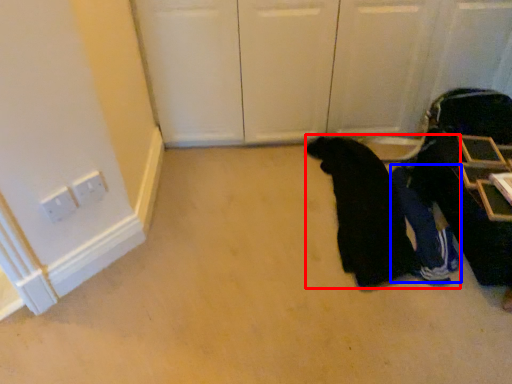
Question: Which object is closer to the camera taking this photo, person (highlighted by a red box) or person (highlighted by a blue box)?

Choices:
 (A) person
 (B) person

Answer: (A)